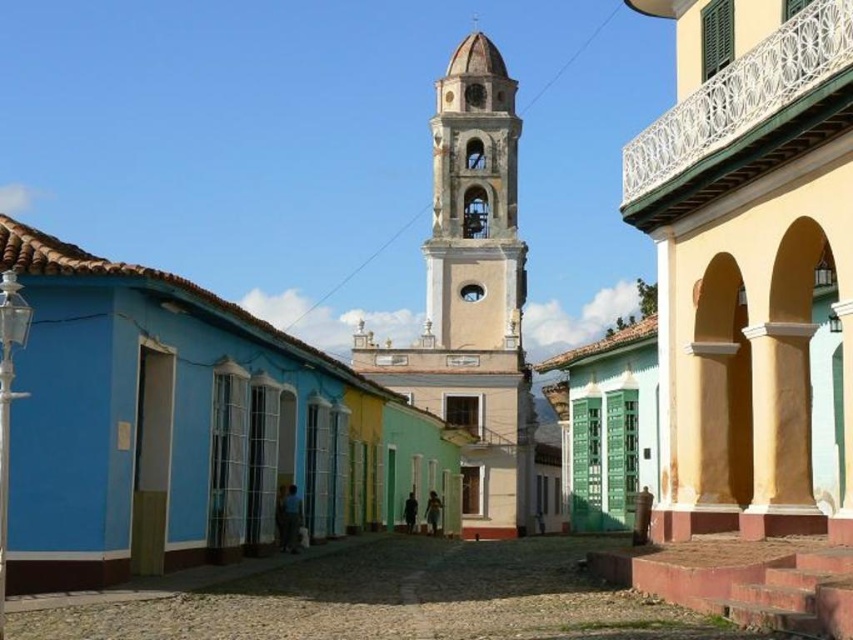
You are standing at the entrance of the street and want to locate the light yellow stucco church at center. According to the coordinates provided, where should you look relative to your position?

The light yellow stucco church at center is located at coordinates point [473,296], which means it is positioned slightly to the right and above your current viewpoint.

You are a tour guide leading a group to a historic site. You need to move a 10 feet long banner between the light yellow stucco church at center and the light beige stone bell tower at center. Is there enough space for the banner to fit through the gap between them?

The distance between the light yellow stucco church at center and the light beige stone bell tower at center is 8.42 feet, which is shorter than the 10 feet long banner. Therefore, the banner cannot fit through the gap between them.

Based on the photo, you are a tourist standing at the entrance of the historic town square. You see the light yellow stucco church at center in the distance. If you want to take a photo of the church without any obstructions, would the current distance be sufficient to capture the entire church in one frame?

The light yellow stucco church at center is 318.33 feet away from the camera. Since this distance allows the entire church to fit within the camera frame without any obstructions, the current distance is sufficient to capture the entire church in one frame.